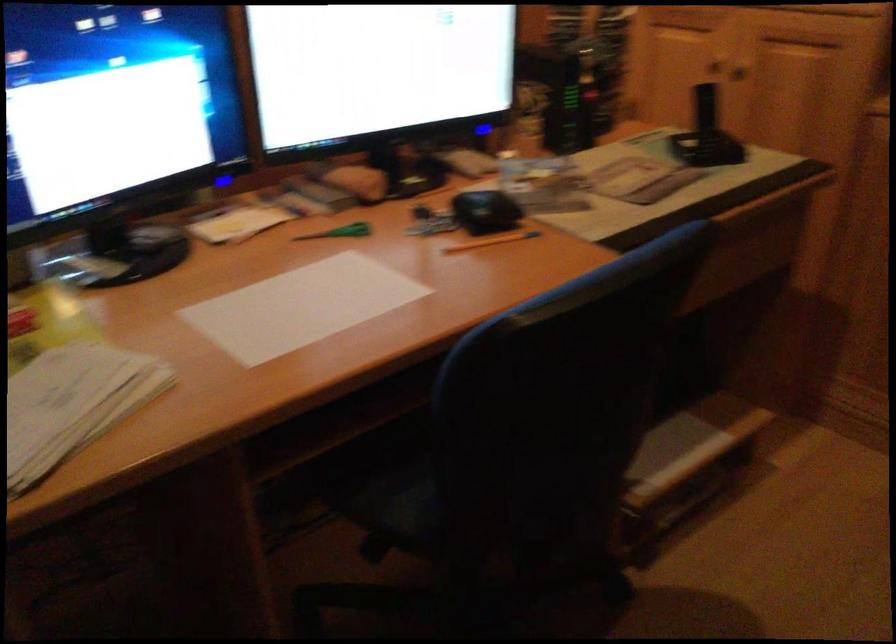
The location [486,211] corresponds to which object?

It corresponds to the black computer mouse in the image.